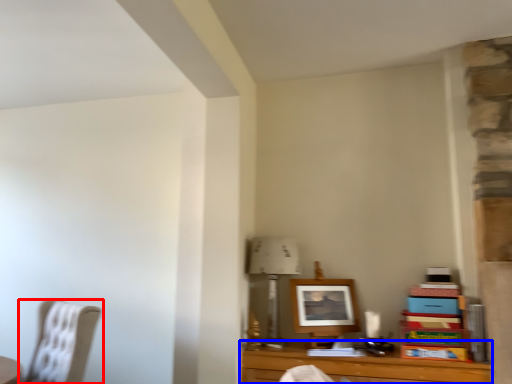
Question: Which object is further to the camera taking this photo, chair (highlighted by a red box) or table (highlighted by a blue box)?

Choices:
 (A) chair
 (B) table

Answer: (A)